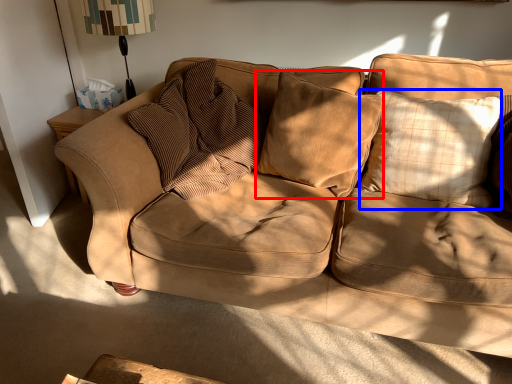
Question: Which point is further to the camera, pillow (highlighted by a red box) or pillow (highlighted by a blue box)?

Choices:
 (A) pillow
 (B) pillow

Answer: (A)